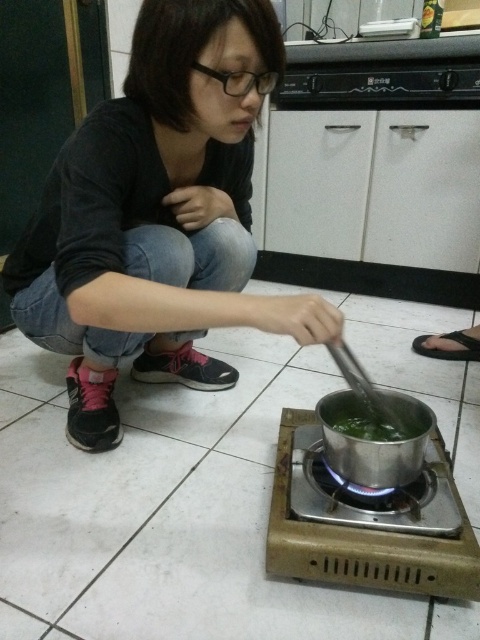
Is matte black shirt at center positioned before green matte pot at center?

That is True.

Does matte black shirt at center have a lesser height compared to green matte pot at center?

No, matte black shirt at center is not shorter than green matte pot at center.

Who is more distant from viewer, (101, 340) or (405, 410)?

Point (101, 340)

You are a GUI agent. You are given a task and a screenshot of the screen. Output one action in this format:
    pyautogui.click(x=<x>, y=<y>)
    Task: Click on the matte black shirt at center
    
    Given the screenshot: What is the action you would take?
    pyautogui.click(x=157, y=216)

Who is more forward, (92, 342) or (309, 556)?

Point (309, 556)

This screenshot has height=640, width=480. I want to click on matte black shirt at center, so click(157, 216).

Between silver metallic gas stove at center and green matte pot at center, which one is positioned higher?

green matte pot at center is above.

Does silver metallic gas stove at center have a smaller size compared to green matte pot at center?

No, silver metallic gas stove at center is not smaller than green matte pot at center.

Which is behind, point (450, 568) or point (340, 426)?

The point (340, 426) is more distant.

Locate an element on the screen. Image resolution: width=480 pixels, height=640 pixels. silver metallic gas stove at center is located at coordinates [363, 544].